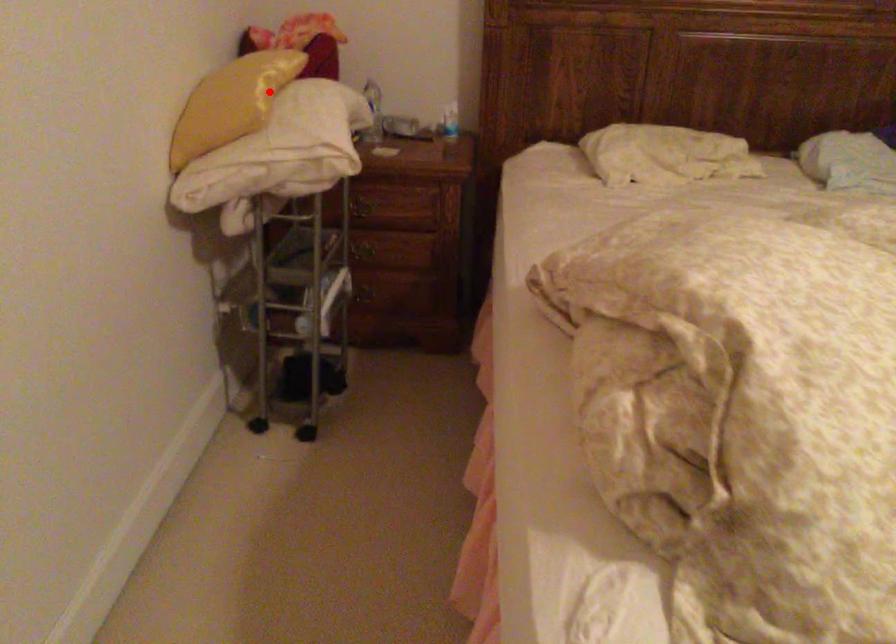
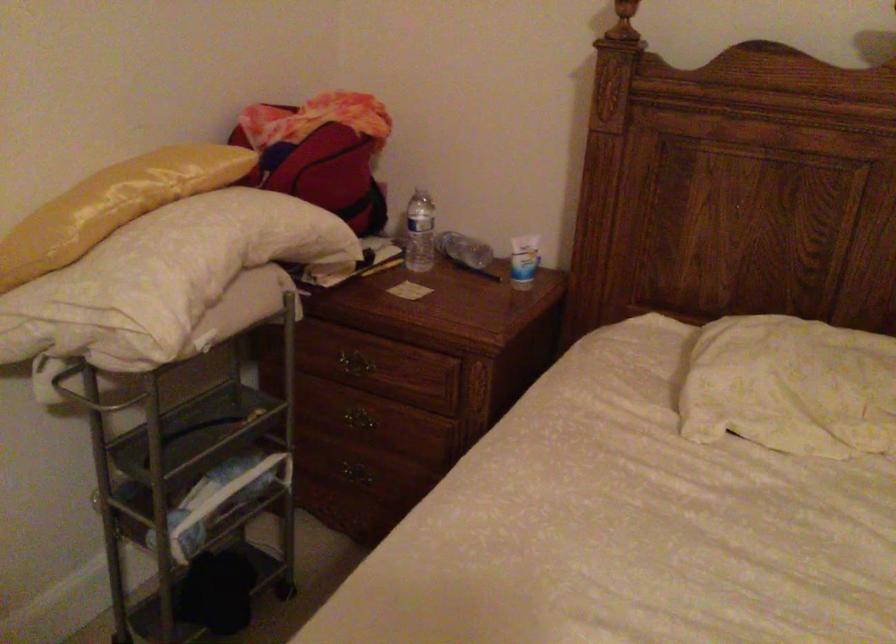
Question: I am providing you with two images of the same scene from different viewpoints. Image1 has a red point marked. In image2, the corresponding 3D location appears at what relative position? Reply with the corresponding letter.

Choices:
 (A) Closer
 (B) Farther

Answer: (A)